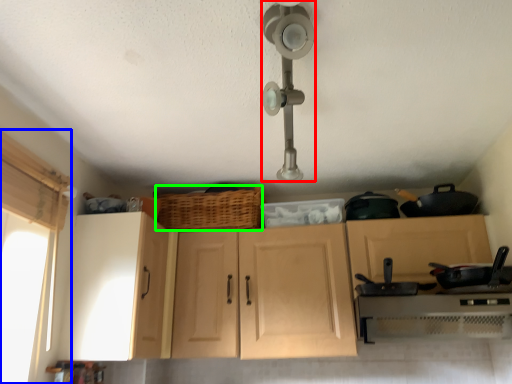
Question: Which is farther away from light fixture (highlighted by a red box)? window screen (highlighted by a blue box) or basket (highlighted by a green box)?

Choices:
 (A) window screen
 (B) basket

Answer: (A)